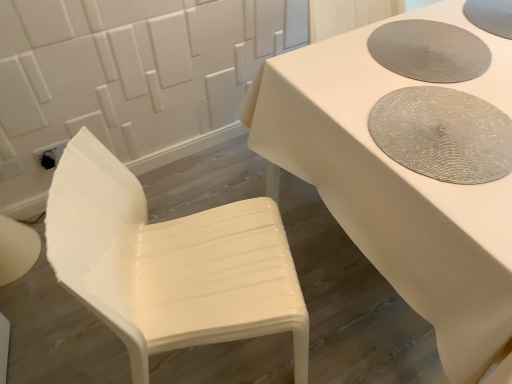
Question: Is textured gray mat at upper right, which is the 3th manhole cover in top-to-bottom order, to the left of white glossy chair at left from the viewer's perspective?

Choices:
 (A) no
 (B) yes

Answer: (A)

Question: Can you confirm if textured gray mat at upper right, which appears as the 1th manhole cover when ordered from the bottom, is thinner than white glossy chair at left?

Choices:
 (A) yes
 (B) no

Answer: (A)

Question: From the image's perspective, is textured gray mat at upper right, which appears as the 1th manhole cover when ordered from the bottom, on top of white glossy chair at left?

Choices:
 (A) yes
 (B) no

Answer: (A)

Question: Is the position of textured gray mat at upper right, which is the 3th manhole cover in top-to-bottom order, more distant than that of white glossy chair at left?

Choices:
 (A) yes
 (B) no

Answer: (A)

Question: From a real-world perspective, is textured gray mat at upper right, which is the 3th manhole cover in top-to-bottom order, located higher than white glossy chair at left?

Choices:
 (A) yes
 (B) no

Answer: (A)

Question: Does textured gray mat at upper right, which is the 3th manhole cover in top-to-bottom order, come in front of white glossy chair at left?

Choices:
 (A) no
 (B) yes

Answer: (A)

Question: Is white glossy chair at left at the right side of white glossy table at center?

Choices:
 (A) yes
 (B) no

Answer: (B)

Question: Does white glossy chair at left have a larger size compared to white glossy table at center?

Choices:
 (A) yes
 (B) no

Answer: (B)

Question: Considering the relative sizes of white glossy chair at left and white glossy table at center in the image provided, is white glossy chair at left wider than white glossy table at center?

Choices:
 (A) yes
 (B) no

Answer: (B)

Question: From a real-world perspective, is white glossy chair at left under white glossy table at center?

Choices:
 (A) yes
 (B) no

Answer: (B)

Question: Considering the relative sizes of white glossy chair at left and white glossy table at center in the image provided, is white glossy chair at left smaller than white glossy table at center?

Choices:
 (A) no
 (B) yes

Answer: (B)

Question: Would you consider white glossy chair at left to be distant from white glossy table at center?

Choices:
 (A) no
 (B) yes

Answer: (A)

Question: Does textured gray placemat at upper right, which ranks as the second manhole cover in top-to-bottom order, have a smaller size compared to white glossy table at center?

Choices:
 (A) yes
 (B) no

Answer: (A)